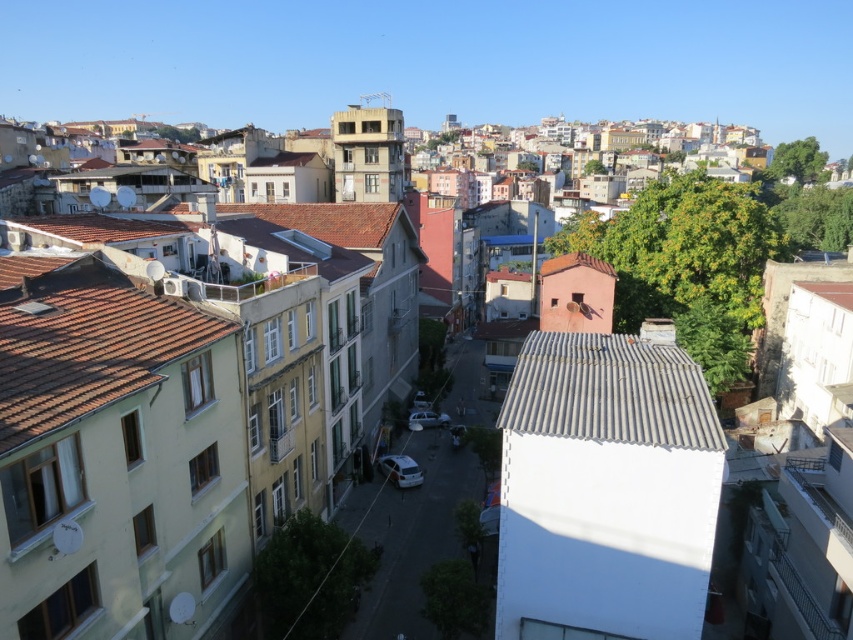
Question: Does brown tile roof at left come behind white corrugated metal roof at center?

Choices:
 (A) no
 (B) yes

Answer: (A)

Question: Does brown tile roof at left come in front of white corrugated metal roof at center?

Choices:
 (A) no
 (B) yes

Answer: (B)

Question: Can you confirm if brown tile roof at left is smaller than white corrugated metal roof at center?

Choices:
 (A) yes
 (B) no

Answer: (B)

Question: Which of the following is the farthest from the observer?

Choices:
 (A) white corrugated metal roof at center
 (B) brown tile roof at left

Answer: (A)

Question: Which point is closer to the camera?

Choices:
 (A) (537, 330)
 (B) (0, 262)

Answer: (B)